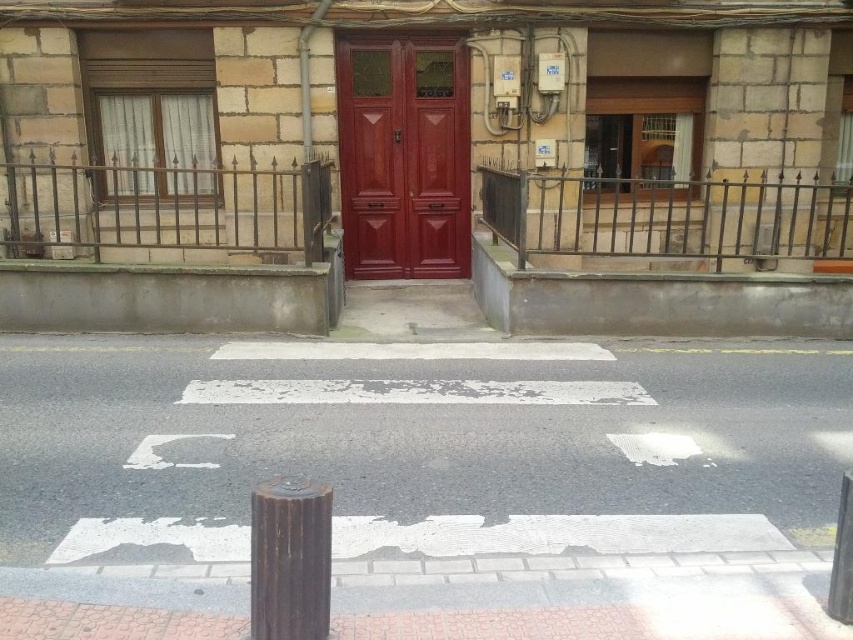
You are a delivery person trying to park your 1.8 meters tall bike stand. You see the white asphalt at center and the matte wood door at center. Which location can accommodate your bike stand based on their heights?

The matte wood door at center is taller than the white asphalt at center, so the bike stand should be placed at the location of the matte wood door at center since it can support taller objects.

You are standing on the sidewalk and want to cross the street. You see the white asphalt at center and the rusty metal pole at lower center. Which object is closer to the road?

The rusty metal pole at lower center is closer to the road because the white asphalt at center is to the right of it, meaning the pole is positioned between the sidewalk and the road.